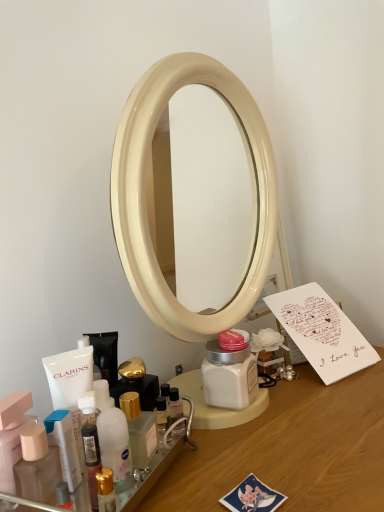
Identify the location of vacant space to the right of matte pink container at lower left, placed as the 3th toiletry when sorted from right to left. The image size is (384, 512). (186, 470).